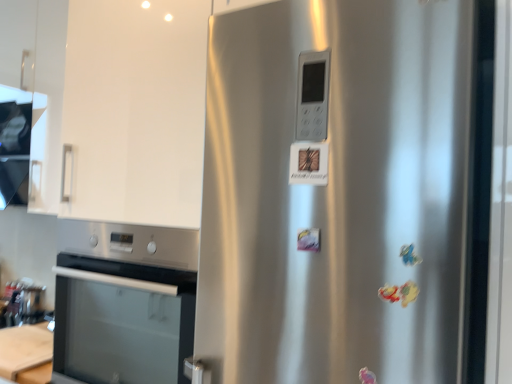
Question: Is wooden at lower left facing away from brushed metal toaster at lower left?

Choices:
 (A) yes
 (B) no

Answer: (B)

Question: Are wooden at lower left and brushed metal toaster at lower left located far from each other?

Choices:
 (A) no
 (B) yes

Answer: (A)

Question: Is wooden at lower left to the left of brushed metal toaster at lower left from the viewer's perspective?

Choices:
 (A) no
 (B) yes

Answer: (A)

Question: From the image's perspective, is wooden at lower left on brushed metal toaster at lower left?

Choices:
 (A) yes
 (B) no

Answer: (B)

Question: Does wooden at lower left have a greater height compared to brushed metal toaster at lower left?

Choices:
 (A) no
 (B) yes

Answer: (A)

Question: Is wooden at lower left next to brushed metal toaster at lower left?

Choices:
 (A) no
 (B) yes

Answer: (A)

Question: Considering the relative positions of stainless steel oven at lower left and satin silver fridge at center in the image provided, is stainless steel oven at lower left to the left of satin silver fridge at center from the viewer's perspective?

Choices:
 (A) no
 (B) yes

Answer: (B)

Question: Is stainless steel oven at lower left far away from satin silver fridge at center?

Choices:
 (A) no
 (B) yes

Answer: (A)

Question: Is stainless steel oven at lower left closer to the viewer compared to satin silver fridge at center?

Choices:
 (A) yes
 (B) no

Answer: (B)

Question: Does stainless steel oven at lower left have a smaller size compared to satin silver fridge at center?

Choices:
 (A) yes
 (B) no

Answer: (A)

Question: Is stainless steel oven at lower left facing towards satin silver fridge at center?

Choices:
 (A) no
 (B) yes

Answer: (A)

Question: From a real-world perspective, is stainless steel oven at lower left beneath satin silver fridge at center?

Choices:
 (A) no
 (B) yes

Answer: (B)

Question: Is brushed metal toaster at lower left completely or partially outside of stainless steel oven at lower left?

Choices:
 (A) no
 (B) yes

Answer: (B)